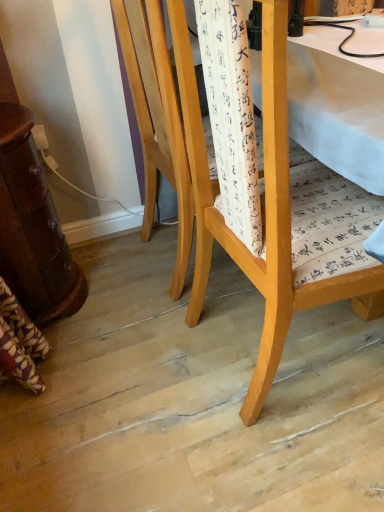
Question: Looking at the image, does light wood chair at center, the 1th chair from the front, seem bigger or smaller compared to light wood chair at center, the 2th chair positioned from the front?

Choices:
 (A) small
 (B) big

Answer: (A)

Question: From their relative heights in the image, would you say light wood chair at center, the 1th chair from the front, is taller or shorter than light wood chair at center, which is the 1th chair from back to front?

Choices:
 (A) tall
 (B) short

Answer: (A)

Question: From the image's perspective, is light wood chair at center, the 1th chair from the front, positioned above or below light wood chair at center, which is the 1th chair from back to front?

Choices:
 (A) below
 (B) above

Answer: (A)

Question: Looking at the image, does light wood chair at center, which is the 1th chair from back to front, seem bigger or smaller compared to light wood chair at center, the 1th chair from the front?

Choices:
 (A) big
 (B) small

Answer: (A)

Question: In the image, is light wood chair at center, the 2th chair positioned from the front, positioned in front of or behind light wood chair at center, the 1th chair from the front?

Choices:
 (A) behind
 (B) front

Answer: (A)

Question: Based on their positions, is light wood chair at center, the 2th chair positioned from the front, located to the left or right of light wood chair at center, the 1th chair from the front?

Choices:
 (A) right
 (B) left

Answer: (B)

Question: Does point (150, 158) appear closer or farther from the camera than point (200, 150)?

Choices:
 (A) closer
 (B) farther

Answer: (B)